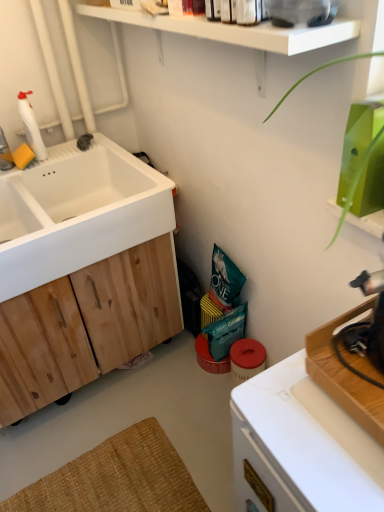
Question: From the image's perspective, is white plastic bottle at upper left on top of white matte sink at left?

Choices:
 (A) no
 (B) yes

Answer: (B)

Question: From the image's perspective, is white plastic bottle at upper left under white matte sink at left?

Choices:
 (A) yes
 (B) no

Answer: (B)

Question: Is white plastic bottle at upper left at the left side of white matte sink at left?

Choices:
 (A) yes
 (B) no

Answer: (A)

Question: Considering the relative sizes of white plastic bottle at upper left and white matte sink at left in the image provided, is white plastic bottle at upper left bigger than white matte sink at left?

Choices:
 (A) yes
 (B) no

Answer: (B)

Question: From a real-world perspective, is white plastic bottle at upper left under white matte sink at left?

Choices:
 (A) yes
 (B) no

Answer: (B)

Question: Is white plastic bottle at upper left bigger or smaller than white plastic countertop at lower right?

Choices:
 (A) big
 (B) small

Answer: (B)

Question: Considering the positions of white plastic bottle at upper left and white plastic countertop at lower right in the image, is white plastic bottle at upper left taller or shorter than white plastic countertop at lower right?

Choices:
 (A) short
 (B) tall

Answer: (A)

Question: Is white plastic bottle at upper left inside the boundaries of white plastic countertop at lower right, or outside?

Choices:
 (A) inside
 (B) outside

Answer: (B)

Question: Is white plastic bottle at upper left wider or thinner than white plastic countertop at lower right?

Choices:
 (A) wide
 (B) thin

Answer: (B)

Question: From the image's perspective, is white plastic countertop at lower right located above or below white plastic bottle at upper left?

Choices:
 (A) above
 (B) below

Answer: (B)

Question: Is white plastic countertop at lower right situated inside white plastic bottle at upper left or outside?

Choices:
 (A) outside
 (B) inside

Answer: (A)

Question: Is point (278, 366) positioned closer to the camera than point (24, 102)?

Choices:
 (A) farther
 (B) closer

Answer: (B)

Question: Based on their sizes in the image, would you say white plastic countertop at lower right is bigger or smaller than white plastic bottle at upper left?

Choices:
 (A) small
 (B) big

Answer: (B)

Question: Considering the positions of point (38, 333) and point (274, 374), is point (38, 333) closer or farther from the camera than point (274, 374)?

Choices:
 (A) farther
 (B) closer

Answer: (A)

Question: Considering the positions of natural wood cabinet at left and white plastic countertop at lower right in the image, is natural wood cabinet at left bigger or smaller than white plastic countertop at lower right?

Choices:
 (A) small
 (B) big

Answer: (B)